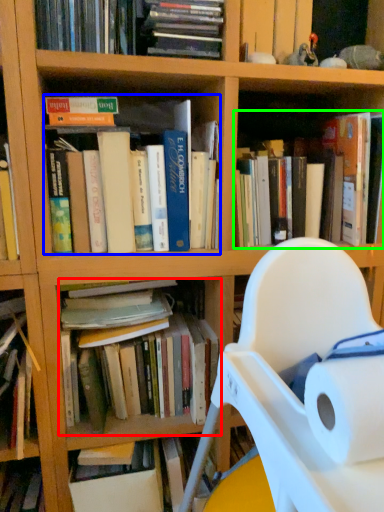
Question: Considering the real-world distances, which object is closest to book (highlighted by a red box)? book (highlighted by a blue box) or book (highlighted by a green box).

Choices:
 (A) book
 (B) book

Answer: (A)